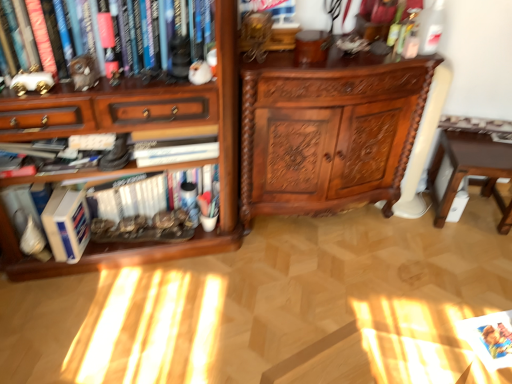
The image size is (512, 384). In order to click on free location in front of polished wood cabinet at center in this screenshot , I will do `click(325, 295)`.